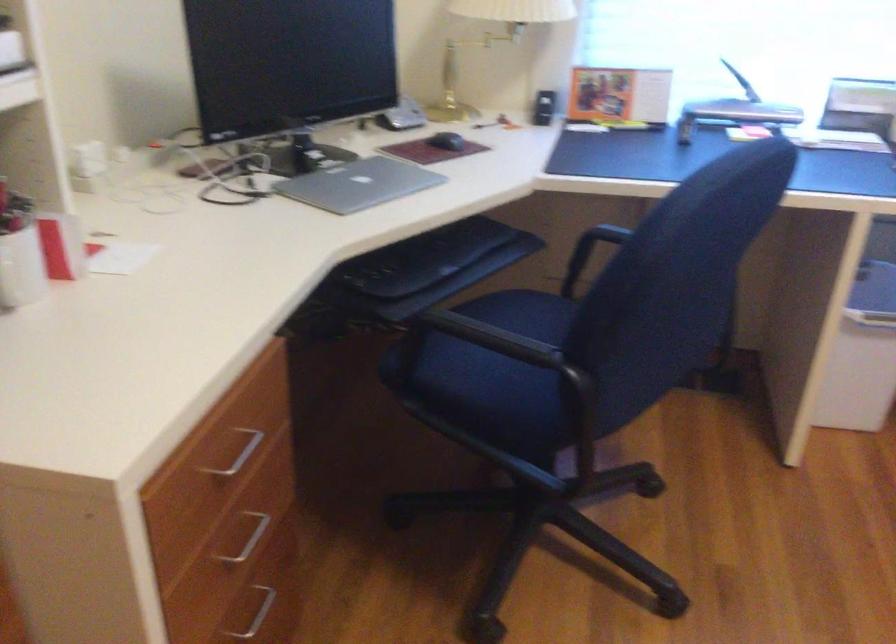
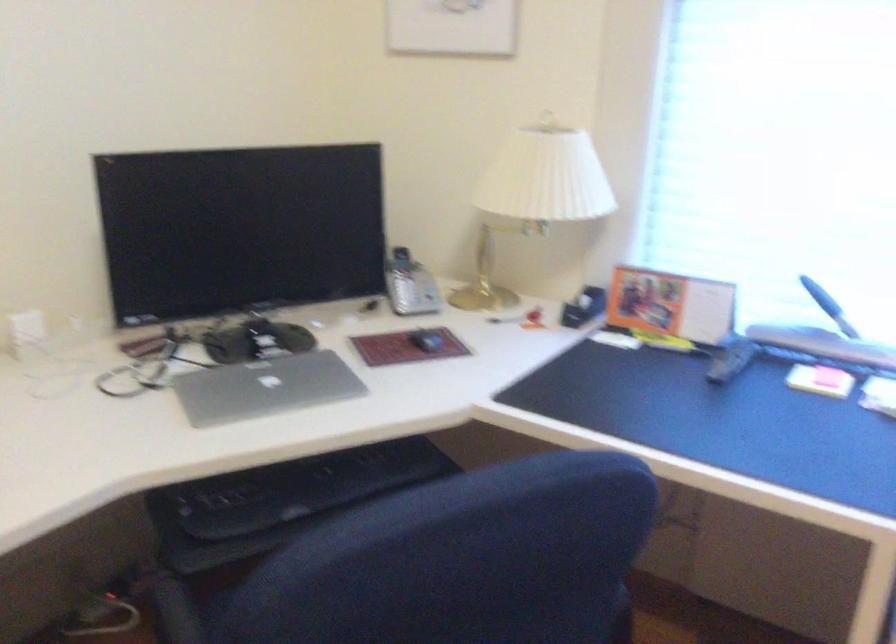
In the second image, find the point that corresponds to pixel 362 184 in the first image.

(264, 386)